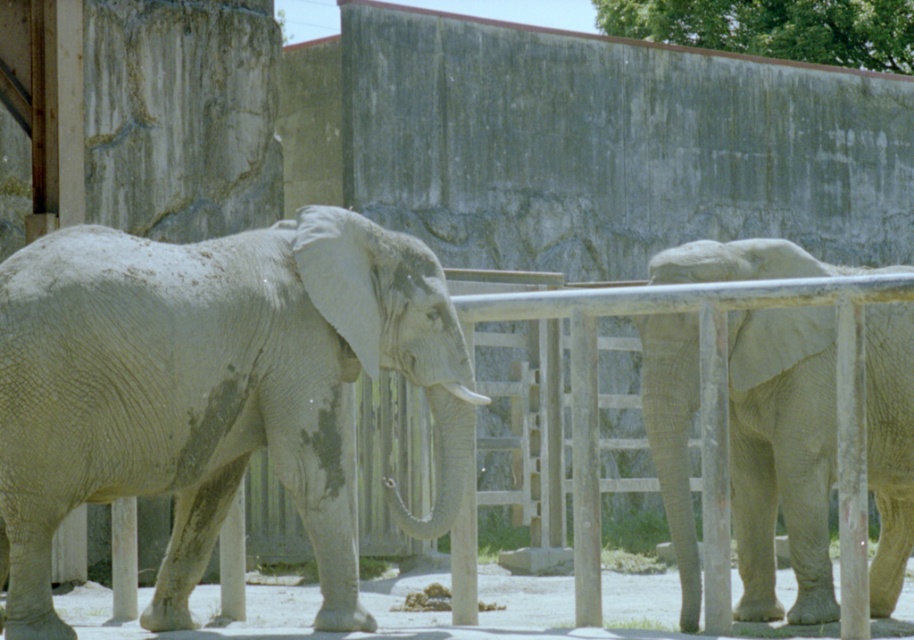
Can you confirm if gray textured elephant at center is smaller than gray textured elephant at right?

Incorrect, gray textured elephant at center is not smaller in size than gray textured elephant at right.

Which is more to the right, gray textured elephant at center or gray textured elephant at right?

From the viewer's perspective, gray textured elephant at right appears more on the right side.

Does point (114, 288) lie behind point (801, 483)?

No, (114, 288) is closer to viewer.

This screenshot has width=914, height=640. I want to click on gray textured elephant at center, so click(x=211, y=390).